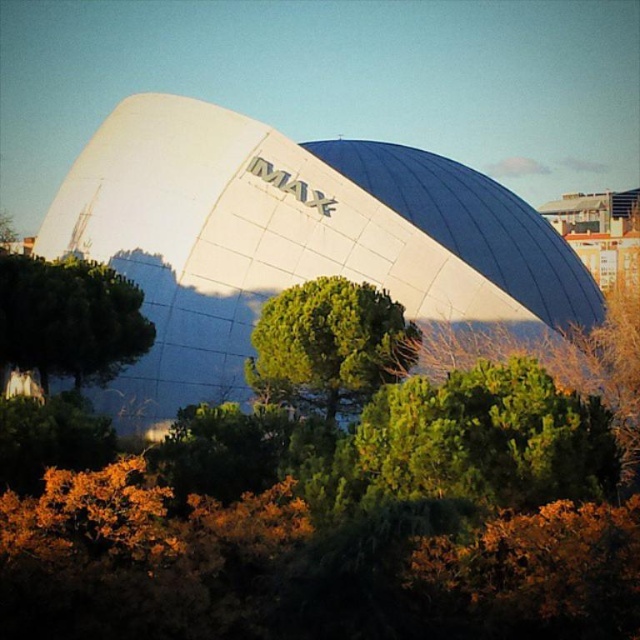
Question: Does green leafy tree at center appear on the right side of green leafy tree at left?

Choices:
 (A) yes
 (B) no

Answer: (A)

Question: Is green leafy tree at center to the right of green leafy tree at left from the viewer's perspective?

Choices:
 (A) no
 (B) yes

Answer: (B)

Question: Which point is farther from the camera taking this photo?

Choices:
 (A) (314, 372)
 (B) (118, 300)

Answer: (B)

Question: Among these objects, which one is farthest from the camera?

Choices:
 (A) green leafy tree at left
 (B) green leafy tree at center

Answer: (B)

Question: Considering the relative positions of green leafy tree at center and green leafy tree at left in the image provided, where is green leafy tree at center located with respect to green leafy tree at left?

Choices:
 (A) left
 (B) right

Answer: (B)